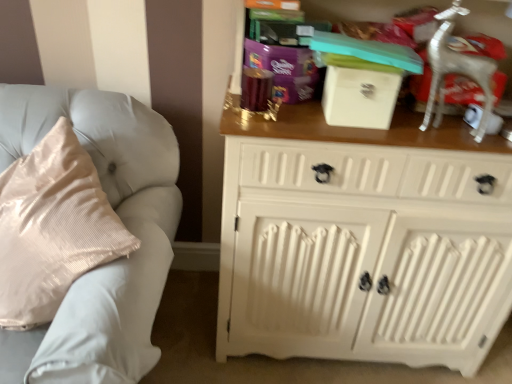
This screenshot has width=512, height=384. Identify the location of silver metallic deer at upper right. (456, 70).

What do you see at coordinates (360, 95) in the screenshot?
I see `white matte box at upper center` at bounding box center [360, 95].

Describe the element at coordinates (362, 242) in the screenshot. I see `white painted wood cabinet at right` at that location.

Image resolution: width=512 pixels, height=384 pixels. Find the location of `purple glossy gift at upper center`. purple glossy gift at upper center is located at coordinates coord(285,69).

You are a GUI agent. You are given a task and a screenshot of the screen. Output one action in this format:
    pyautogui.click(x=<x>, y=<y>)
    Task: Click on the silver metallic deer at upper right
    
    Given the screenshot: What is the action you would take?
    pyautogui.click(x=456, y=70)

From a real-world perspective, is silver metallic deer at upper right over white matte box at upper center?

Yes.

The height and width of the screenshot is (384, 512). In order to click on box that appears behind the silver metallic deer at upper right in this screenshot , I will do `click(360, 95)`.

Considering the sizes of silver metallic deer at upper right and white matte box at upper center in the image, is silver metallic deer at upper right taller or shorter than white matte box at upper center?

silver metallic deer at upper right is taller than white matte box at upper center.

Measure the distance from white painted wood cabinet at right to light gray fabric couch at left.

A distance of 54.55 centimeters exists between white painted wood cabinet at right and light gray fabric couch at left.

Is point (455, 337) behind point (144, 355)?

Yes, it is behind point (144, 355).

Where is `chest of drawers behind the light gray fabric couch at left`? The image size is (512, 384). chest of drawers behind the light gray fabric couch at left is located at coordinates (362, 242).

From their relative heights in the image, would you say white painted wood cabinet at right is taller or shorter than light gray fabric couch at left?

In the image, white painted wood cabinet at right appears to be taller than light gray fabric couch at left.

Would you say light gray fabric couch at left is a long distance from white painted wood cabinet at right?

That's not correct — light gray fabric couch at left is a little close to white painted wood cabinet at right.

From the image's perspective, which one is positioned higher, light gray fabric couch at left or white painted wood cabinet at right?

white painted wood cabinet at right, from the image's perspective.

Between light gray fabric couch at left and white painted wood cabinet at right, which one appears on the left side from the viewer's perspective?

Positioned to the left is light gray fabric couch at left.

Does light gray fabric couch at left come in front of white painted wood cabinet at right?

Yes, it is in front of white painted wood cabinet at right.

From a real-world perspective, between white matte box at upper center and light gray fabric couch at left, who is vertically lower?

light gray fabric couch at left, from a real-world perspective.

Which is less distant, [387,72] or [52,380]?

The point [52,380] is more forward.

I want to click on furniture below the white matte box at upper center (from a real-world perspective), so click(122, 221).

Between point (128, 305) and point (330, 94), which one is positioned behind?

The point (330, 94) is behind.

Is light gray fabric couch at left not within white matte box at upper center?

Yes, light gray fabric couch at left is located beyond the bounds of white matte box at upper center.

Based on the photo, from the image's perspective, which object appears higher, light gray fabric couch at left or white matte box at upper center?

From the image's view, white matte box at upper center is above.

Could you tell me if light gray fabric couch at left is facing white matte box at upper center?

No, light gray fabric couch at left does not turn towards white matte box at upper center.

Between point (293, 48) and point (9, 130), which one is positioned behind?

The point (9, 130) is farther from the camera.

Between purple glossy gift at upper center and light gray fabric couch at left, which one appears on the left side from the viewer's perspective?

light gray fabric couch at left.

Considering the relative sizes of purple glossy gift at upper center and light gray fabric couch at left in the image provided, is purple glossy gift at upper center bigger than light gray fabric couch at left?

Actually, purple glossy gift at upper center might be smaller than light gray fabric couch at left.

Does purple glossy gift at upper center contain light gray fabric couch at left?

No, light gray fabric couch at left is not a part of purple glossy gift at upper center.

This screenshot has width=512, height=384. I want to click on gift above the light gray fabric couch at left (from a real-world perspective), so click(x=285, y=69).

From the image's perspective, which one is positioned lower, light gray fabric couch at left or purple glossy gift at upper center?

light gray fabric couch at left appears lower in the image.

Is light gray fabric couch at left wider than purple glossy gift at upper center?

Correct, the width of light gray fabric couch at left exceeds that of purple glossy gift at upper center.

Is purple glossy gift at upper center completely or partially inside light gray fabric couch at left?

Result: That's incorrect, purple glossy gift at upper center is not inside light gray fabric couch at left.

Identify the location of box below the silver metallic deer at upper right (from a real-world perspective). (360, 95).

This screenshot has width=512, height=384. Find the location of `chest of drawers on the right of light gray fabric couch at left`. chest of drawers on the right of light gray fabric couch at left is located at coordinates (362, 242).

From the image, which object appears to be farther from white painted wood cabinet at right, purple glossy gift at upper center or light gray fabric couch at left?

The object further to white painted wood cabinet at right is light gray fabric couch at left.

Looking at the image, which one is located further to light gray fabric couch at left, silver metallic deer at upper right or white painted wood cabinet at right?

silver metallic deer at upper right lies further to light gray fabric couch at left than the other object.

Estimate the real-world distances between objects in this image. Which object is further from white matte box at upper center, white painted wood cabinet at right or purple glossy gift at upper center?

white painted wood cabinet at right is positioned further to the anchor white matte box at upper center.

Estimate the real-world distances between objects in this image. Which object is closer to white matte box at upper center, silver metallic deer at upper right or white painted wood cabinet at right?

The object closer to white matte box at upper center is silver metallic deer at upper right.

Looking at the image, which one is located further to white matte box at upper center, silver metallic deer at upper right or light gray fabric couch at left?

light gray fabric couch at left.

Considering their positions, is white painted wood cabinet at right positioned further to purple glossy gift at upper center than white matte box at upper center?

Among the two, white painted wood cabinet at right is located further to purple glossy gift at upper center.

From the image, which object appears to be nearer to light gray fabric couch at left, white painted wood cabinet at right or purple glossy gift at upper center?

white painted wood cabinet at right is closer to light gray fabric couch at left.

Based on their spatial positions, is purple glossy gift at upper center or white painted wood cabinet at right further from silver metallic deer at upper right?

Based on the image, white painted wood cabinet at right appears to be further to silver metallic deer at upper right.

Locate an element on the screen. the chest of drawers situated between light gray fabric couch at left and silver metallic deer at upper right from left to right is located at coordinates (362, 242).

Find the location of a particular element. The width and height of the screenshot is (512, 384). chest of drawers between purple glossy gift at upper center and silver metallic deer at upper right from left to right is located at coordinates (362, 242).

This screenshot has width=512, height=384. In order to click on box between light gray fabric couch at left and white painted wood cabinet at right in the horizontal direction in this screenshot , I will do `click(360, 95)`.

The height and width of the screenshot is (384, 512). Identify the location of box located between purple glossy gift at upper center and silver metallic deer at upper right in the left-right direction. (360, 95).